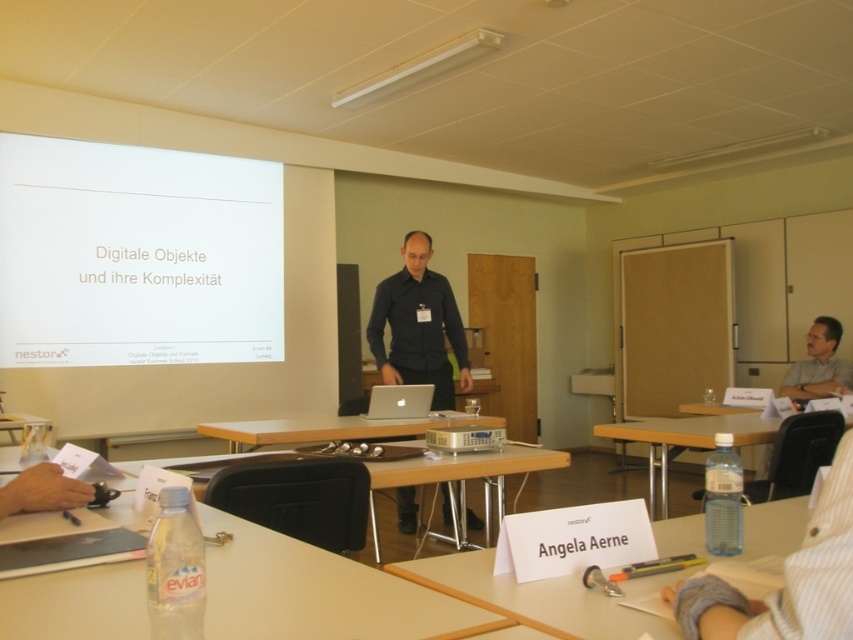
In the classroom scene, there is a white paper at lower right and a clear plastic water bottle at lower right. Which object is positioned to the left of the other?

The white paper at lower right is to the left of the clear plastic water bottle at lower right.

Where is the clear plastic water bottle at lower right located in the image?

The clear plastic water bottle at lower right is located at point (683, 442).